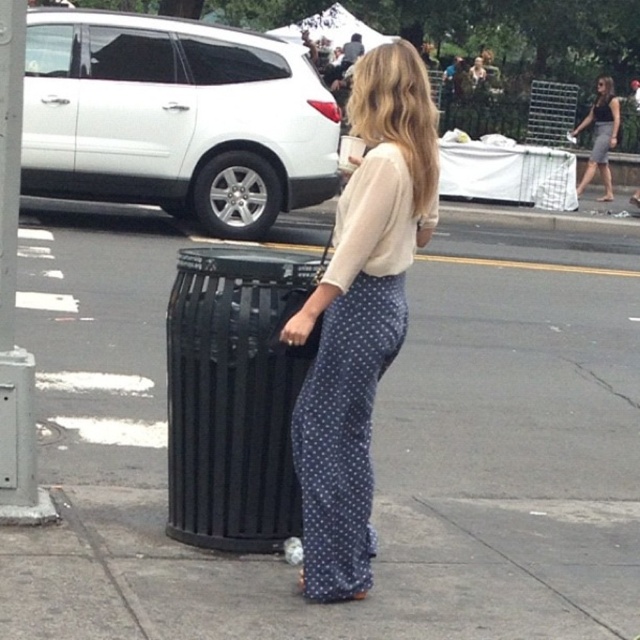
Question: Is smooth asphalt pavement at center wider than dark gray textured dress at center?

Choices:
 (A) yes
 (B) no

Answer: (A)

Question: Can you confirm if matte beige blouse at center is positioned to the left of gray textured skirt at right?

Choices:
 (A) yes
 (B) no

Answer: (A)

Question: Among these objects, which one is nearest to the camera?

Choices:
 (A) matte beige blouse at center
 (B) gray textured skirt at right
 (C) dark gray textured dress at center
 (D) smooth asphalt pavement at center

Answer: (D)

Question: Which object appears closest to the camera in this image?

Choices:
 (A) black metal trash can at center
 (B) matte beige blouse at center
 (C) dark gray textured dress at center

Answer: (B)

Question: Can you confirm if smooth asphalt pavement at center is positioned to the right of gray textured skirt at right?

Choices:
 (A) yes
 (B) no

Answer: (B)

Question: Which object is farther from the camera taking this photo?

Choices:
 (A) smooth asphalt pavement at center
 (B) gray textured skirt at right

Answer: (B)